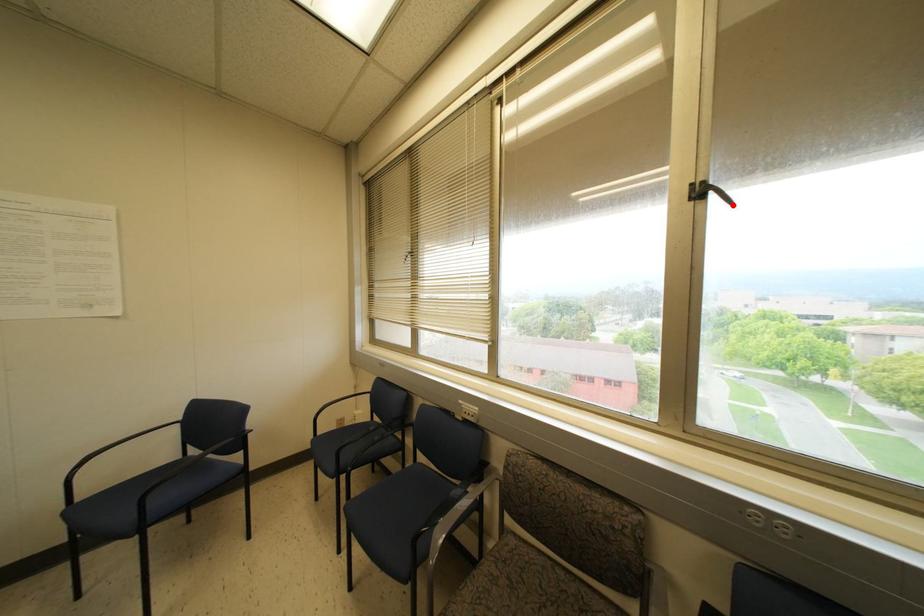
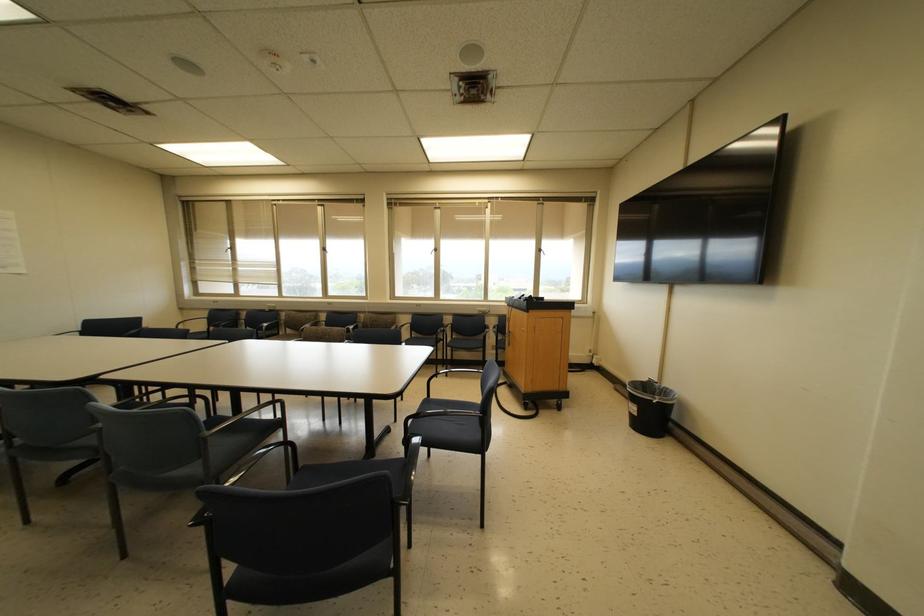
In the second image, find the point that corresponds to the highlighted location in the first image.

(327, 253)